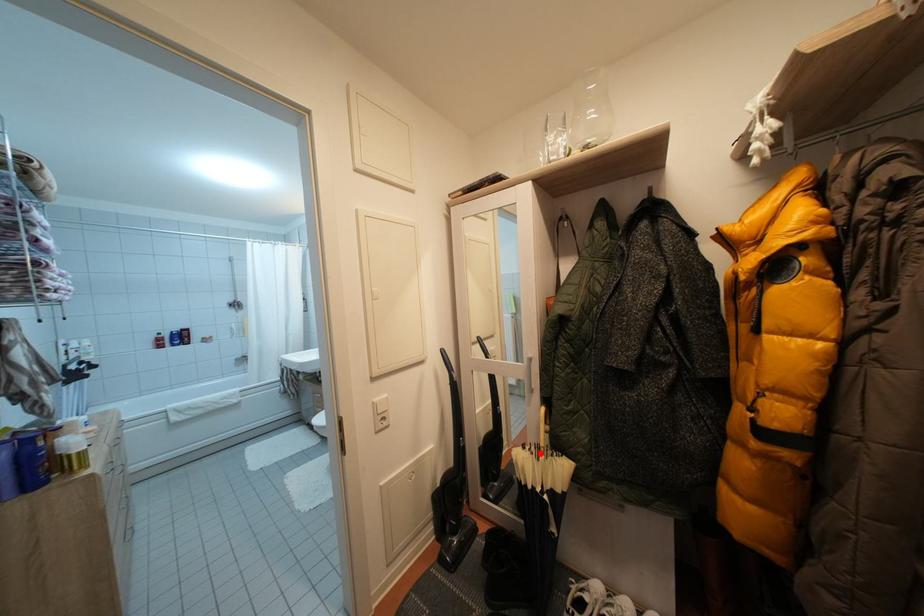
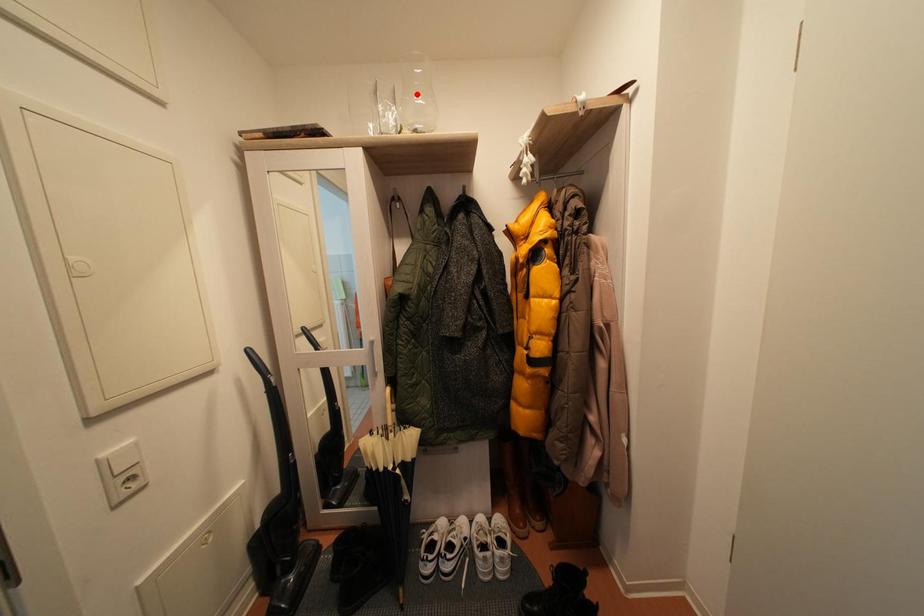
I am providing you with two images of the same scene from different viewpoints. A red point is marked on the first image and another point is marked on the second image. Is the red point in image1 aligned with the point shown in image2?

No